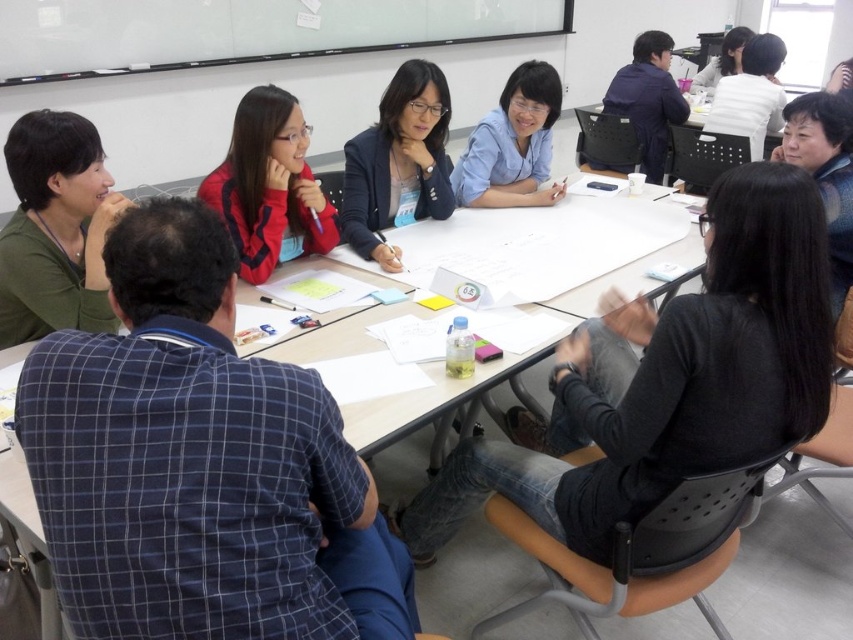
Is matte red jacket at center thinner than matte black jacket at upper center?

Indeed, matte red jacket at center has a lesser width compared to matte black jacket at upper center.

Who is shorter, matte red jacket at center or matte black jacket at upper center?

matte red jacket at center is shorter.

This screenshot has width=853, height=640. What are the coordinates of `matte red jacket at center` in the screenshot? It's located at (270, 186).

Does green matte shirt at left come behind blue matte shirt at center?

No, green matte shirt at left is in front of blue matte shirt at center.

Does point (76, 301) come behind point (508, 128)?

No, it is not.

Locate an element on the screen. The height and width of the screenshot is (640, 853). green matte shirt at left is located at coordinates (55, 228).

Does matte red jacket at center appear on the left side of blue matte shirt at center?

Yes, matte red jacket at center is to the left of blue matte shirt at center.

Does matte red jacket at center have a smaller size compared to blue matte shirt at center?

Correct, matte red jacket at center occupies less space than blue matte shirt at center.

Is point (274, 116) positioned behind point (460, 177)?

No, (274, 116) is in front of (460, 177).

Where is `matte red jacket at center`? matte red jacket at center is located at coordinates (270, 186).